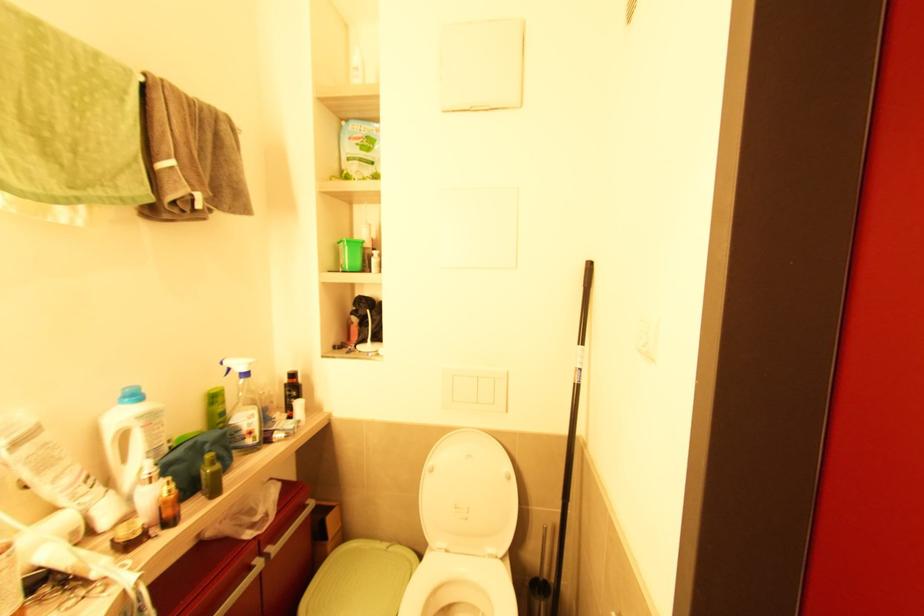
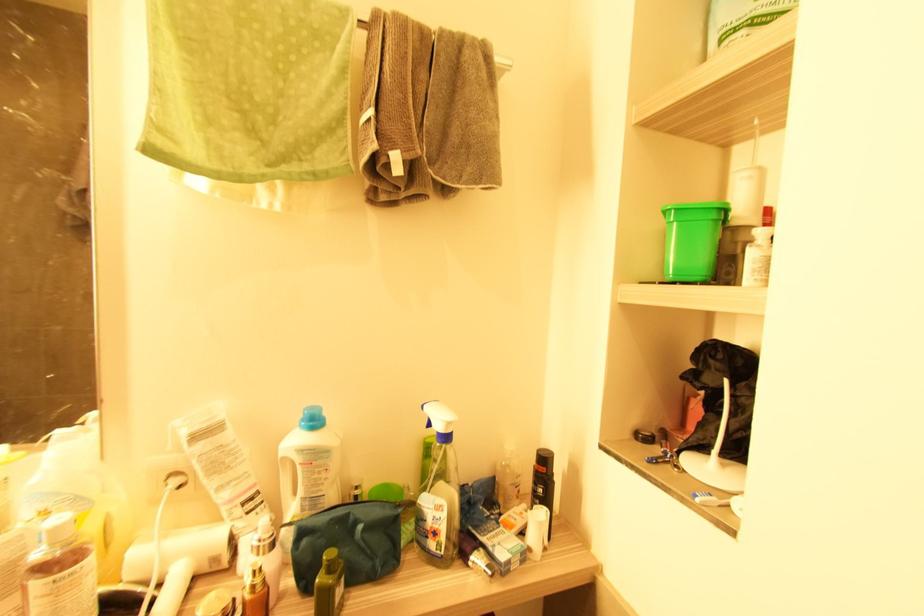
Where in the second image is the point corresponding to point 155,423 from the first image?

(315, 464)